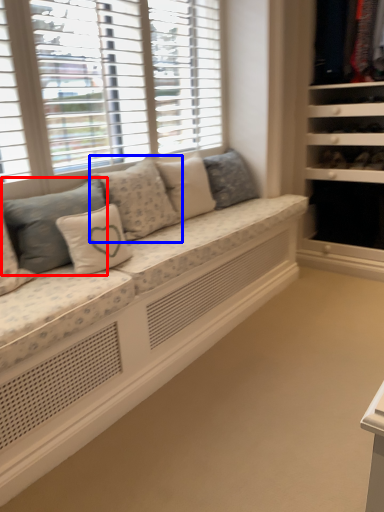
Question: Which object appears farthest to the camera in this image, pillow (highlighted by a red box) or pillow (highlighted by a blue box)?

Choices:
 (A) pillow
 (B) pillow

Answer: (B)